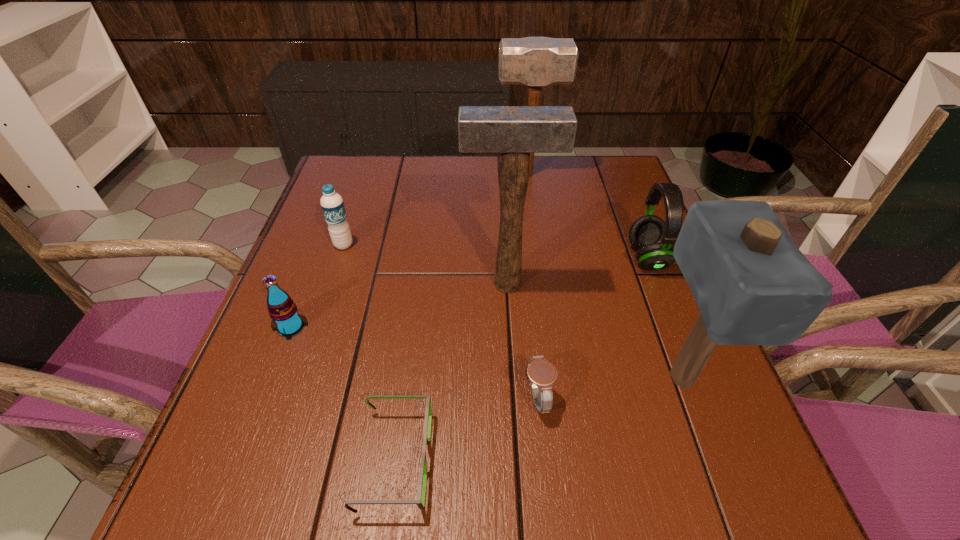
Where is `the second farthest mallet`? the second farthest mallet is located at coordinates (514, 131).

The image size is (960, 540). In order to click on the farthest object in this screenshot , I will do point(532,61).

Locate an element on the screen. The height and width of the screenshot is (540, 960). the nearest mallet is located at coordinates (753, 286).

At what (x,y) coordinates should I click in order to perform the action: click on headset. Please return your answer as a coordinate pair (x, y). The height and width of the screenshot is (540, 960). Looking at the image, I should click on (654, 239).

At what (x,y) coordinates should I click in order to perform the action: click on water bottle. Please return your answer as a coordinate pair (x, y). The width and height of the screenshot is (960, 540). Looking at the image, I should click on (332, 204).

Where is `soda`? The image size is (960, 540). soda is located at coordinates (283, 311).

Identify the location of watch. (542, 374).

I want to click on spectacles, so click(420, 502).

This screenshot has width=960, height=540. What are the coordinates of `the third object from left to right` in the screenshot? It's located at click(x=420, y=502).

The height and width of the screenshot is (540, 960). What are the coordinates of `free space located 0.250m on the back of the second nearest mallet` in the screenshot? It's located at [x=502, y=206].